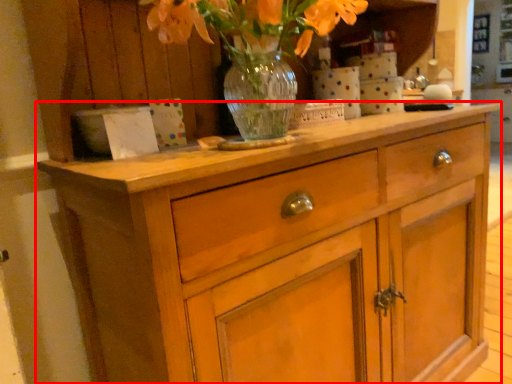
Question: Observing the image, what is the correct spatial positioning of chest of drawers (annotated by the red box) in reference to floral arrangement?

Choices:
 (A) right
 (B) left

Answer: (A)